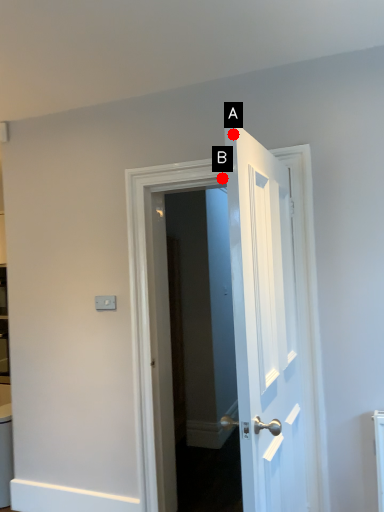
Question: Two points are circled on the image, labeled by A and B beside each circle. Among these points, which one is farthest from the camera?

Choices:
 (A) A is further
 (B) B is further

Answer: (B)